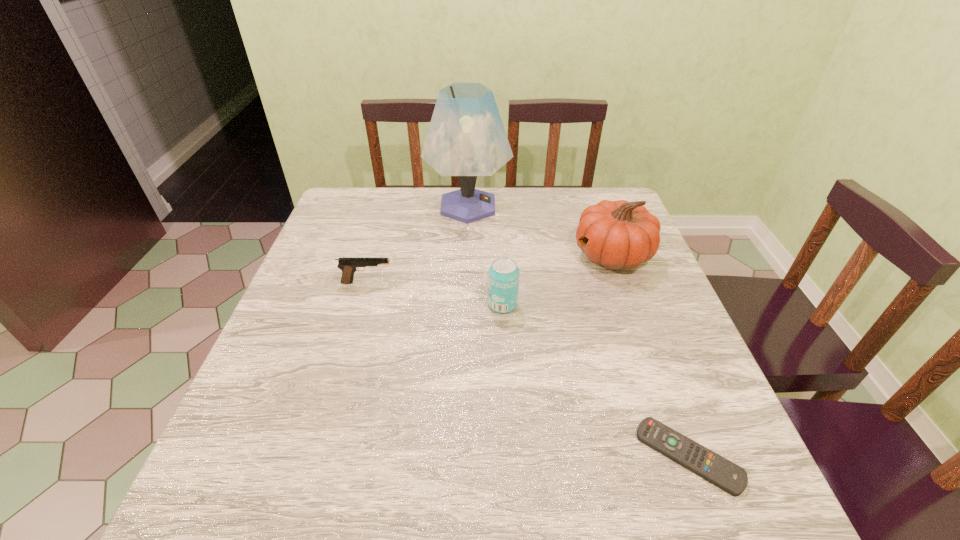
At what (x,y) coordinates should I click in order to perform the action: click on free space located 0.300m on the face of the pumpkin. Please return your answer as a coordinate pair (x, y). The width and height of the screenshot is (960, 540). Looking at the image, I should click on pos(460,255).

You are a GUI agent. You are given a task and a screenshot of the screen. Output one action in this format:
    pyautogui.click(x=<x>, y=<y>)
    Task: Click on the free location located 0.240m on the face of the pumpkin
    The height and width of the screenshot is (540, 960).
    Given the screenshot: What is the action you would take?
    pyautogui.click(x=483, y=255)

You are a GUI agent. You are given a task and a screenshot of the screen. Output one action in this format:
    pyautogui.click(x=<x>, y=<y>)
    Task: Click on the blank area located 0.060m on the face of the pumpkin
    This screenshot has height=540, width=960.
    Given the screenshot: What is the action you would take?
    pyautogui.click(x=550, y=255)

Identify the location of vacant space positioned 0.060m on the front of the third tallest object. The image size is (960, 540). (504, 335).

Find the location of a particular element. The height and width of the screenshot is (540, 960). free location located at the muzzle of the pistol is located at coordinates (546, 282).

Where is `free region located 0.090m on the back of the remote control`? free region located 0.090m on the back of the remote control is located at coordinates (660, 380).

Locate an element on the screen. Image resolution: width=960 pixels, height=540 pixels. object that is positioned at the far edge is located at coordinates (466, 138).

I want to click on object present at the near edge, so click(728, 476).

Locate an element on the screen. object present at the left edge is located at coordinates (349, 266).

Locate an element on the screen. Image resolution: width=960 pixels, height=540 pixels. pumpkin that is at the right edge is located at coordinates click(x=619, y=234).